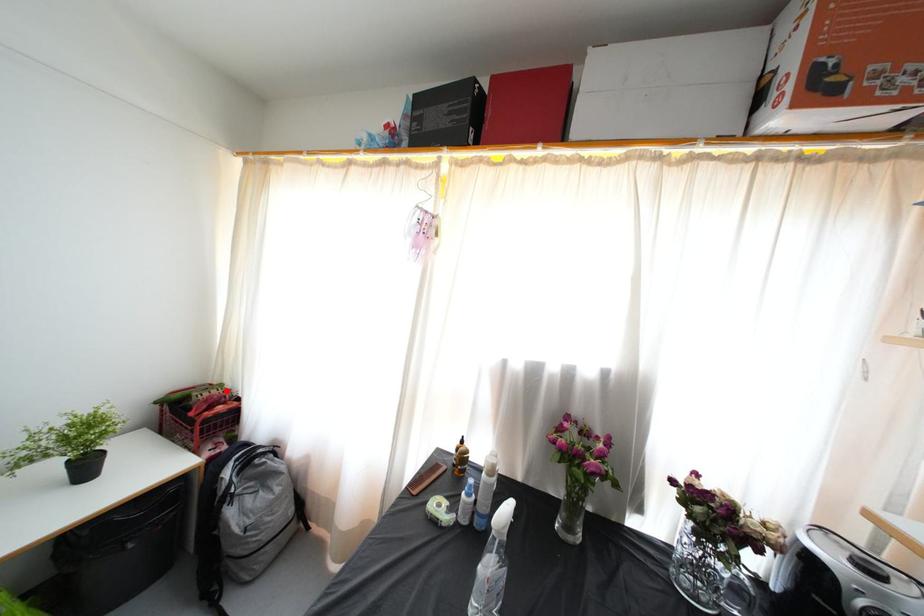
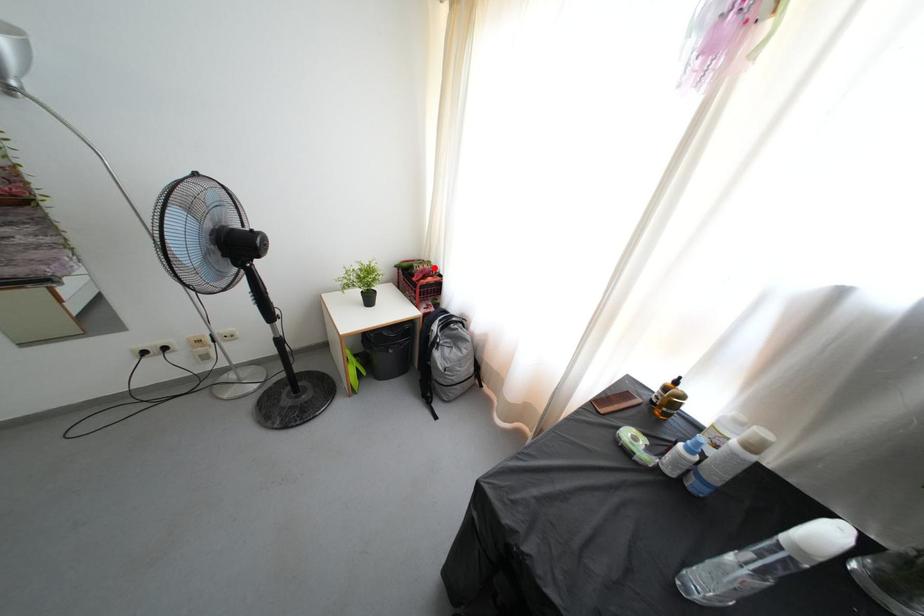
I am providing you with two images of the same scene from different viewpoints. A red point is marked on the first image and another point is marked on the second image. Are the points marked in image1 and image2 representing the same 3D position?

Yes